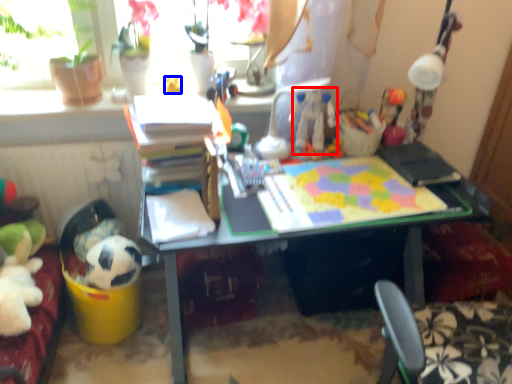
Question: Which of the following is the farthest to the observer, toy (highlighted by a red box) or toy (highlighted by a blue box)?

Choices:
 (A) toy
 (B) toy

Answer: (B)